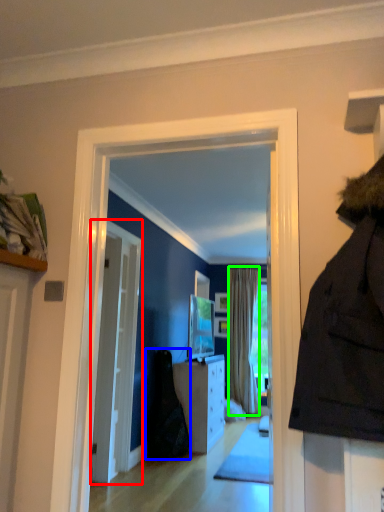
Question: Which object is the closest to the door (highlighted by a red box)? Choose among these: dark (highlighted by a blue box) or curtain (highlighted by a green box).

Choices:
 (A) dark
 (B) curtain

Answer: (A)